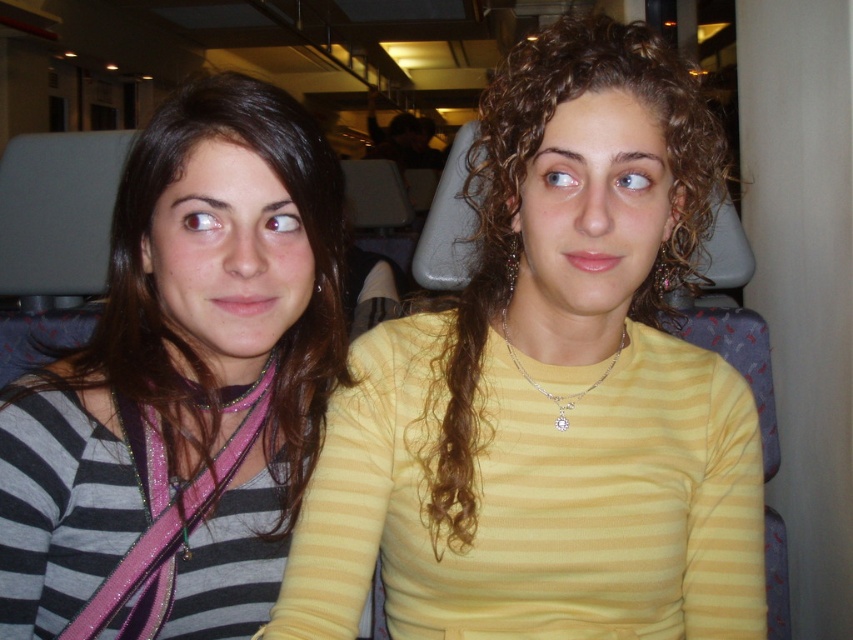
You are a passenger on a train and need to locate the yellow striped shirt at center. According to the coordinates provided, where exactly would you find it?

The yellow striped shirt at center is located at point (550, 392).

You are a passenger in a train seat. You want to know if the yellow striped shirt at center is wider than the striped fabric shirt at left. Can you determine this based on the scene?

The yellow striped shirt at center might be wider than striped fabric shirt at left.

You are a photographer taking a photo of two people sitting on a train. You notice the yellow striped shirt at center and the striped fabric shirt at left. Which person should you adjust to ensure both shirts are equally visible in the photo?

The yellow striped shirt at center is much taller than the striped fabric shirt at left, so you should lower the height of the yellow striped shirt at center to match the height of the striped fabric shirt at left.